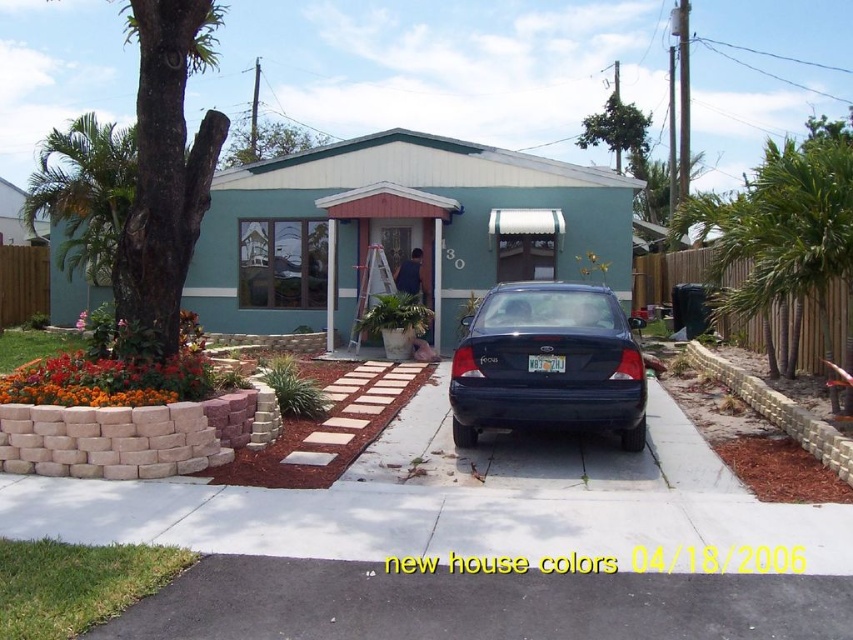
You are a delivery person trying to park your van next to the glossy dark blue sedan at center. The van is taller than the sedan. Can you park your van on the black asphalt driveway at lower center without hitting the roof?

The black asphalt driveway at lower center has a lesser height compared to the glossy dark blue sedan at center. Since the driveway is shorter in height than the sedan, and your van is taller than the sedan, parking the van there might cause the roof to hit the driveway. Therefore, it is not advisable to park the van there.

You are a delivery person trying to park your van next to the glossy dark blue sedan at center. The van is the same length as the driveway. Can you fit your van on the black asphalt driveway at lower center without overlapping the sedan?

The black asphalt driveway at lower center is smaller than the glossy dark blue sedan at center. Since the van is the same length as the driveway, it cannot fit without overlapping the sedan.

You are a delivery person trying to park your van next to the glossy dark blue sedan at center. The van is 2 meters wide. Can you fit your van on the black asphalt driveway at lower center without overlapping the sedan?

The black asphalt driveway at lower center is wider than the glossy dark blue sedan at center, so yes, the van can fit alongside the glossy dark blue sedan at center on the driveway.